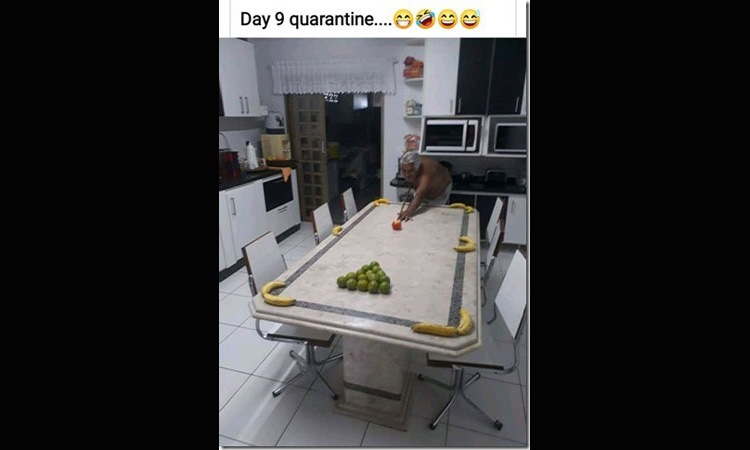
Where is `underneath the table`? The height and width of the screenshot is (450, 750). underneath the table is located at coordinates (418, 391).